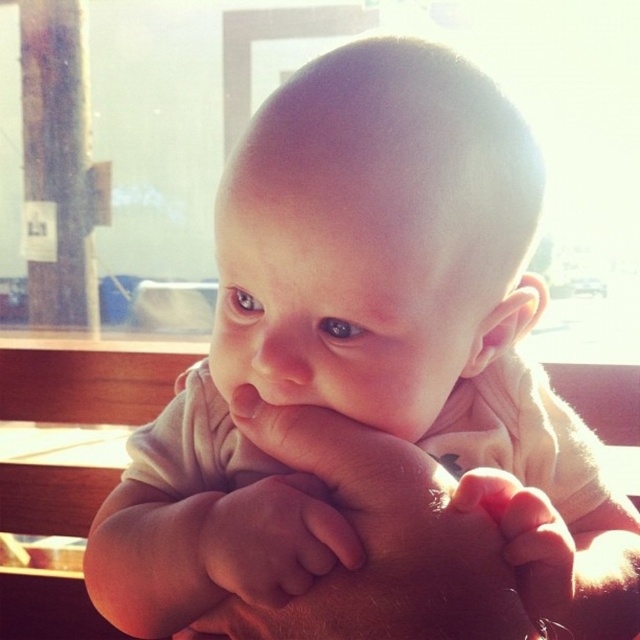
You are a photographer trying to capture a close shot of the baby. The pink soft skin at center and the soft skin hand at lower right are both in your viewfinder. Which area should you focus on to ensure the baby remains in focus if the hand moves closer to the camera?

You should focus on the pink soft skin at center because it is wider than the soft skin hand at lower right, making it more likely to stay in focus if the hand moves closer.

Consider the image. You are a photographer trying to capture the baby in the image. The baby is sitting on an adult lap. You need to ensure the pink soft skin at center and the soft skin hand at lower right are both visible in the shot. Based on their positions, can you determine which part of the baby is closer to the camera?

The pink soft skin at center is located above the soft skin hand at lower right, meaning the pink soft skin at center is closer to the camera than the soft skin hand at lower right.